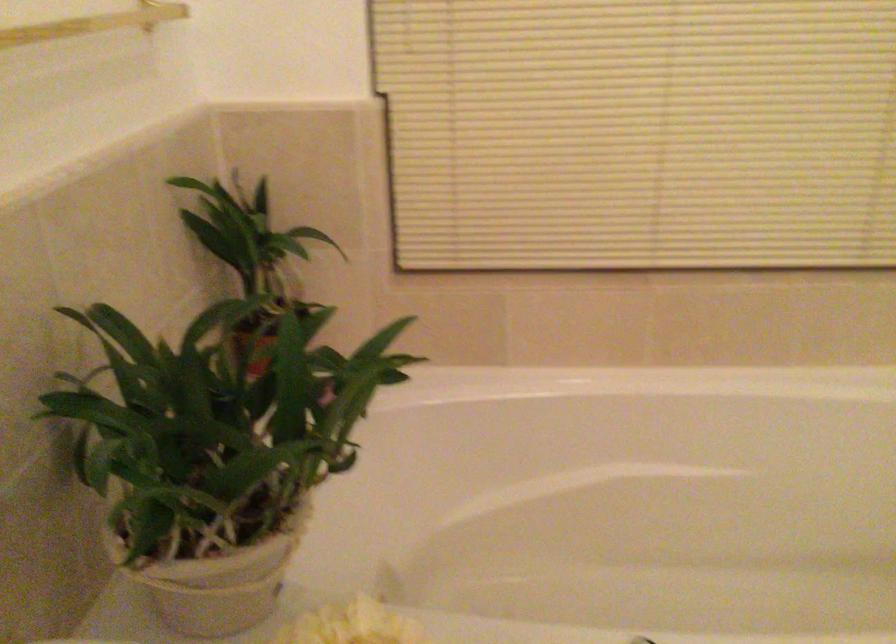
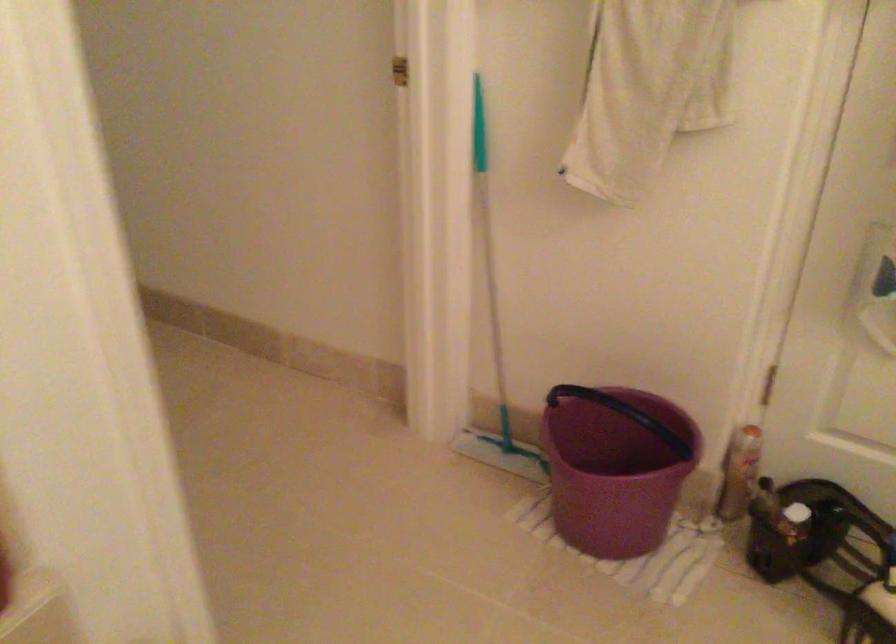
Question: The camera is either moving clockwise (left) or counter-clockwise (right) around the object. The first image is from the beginning of the video and the second image is from the end. Is the camera moving left or right when shooting the video?

Choices:
 (A) Left
 (B) Right

Answer: (A)